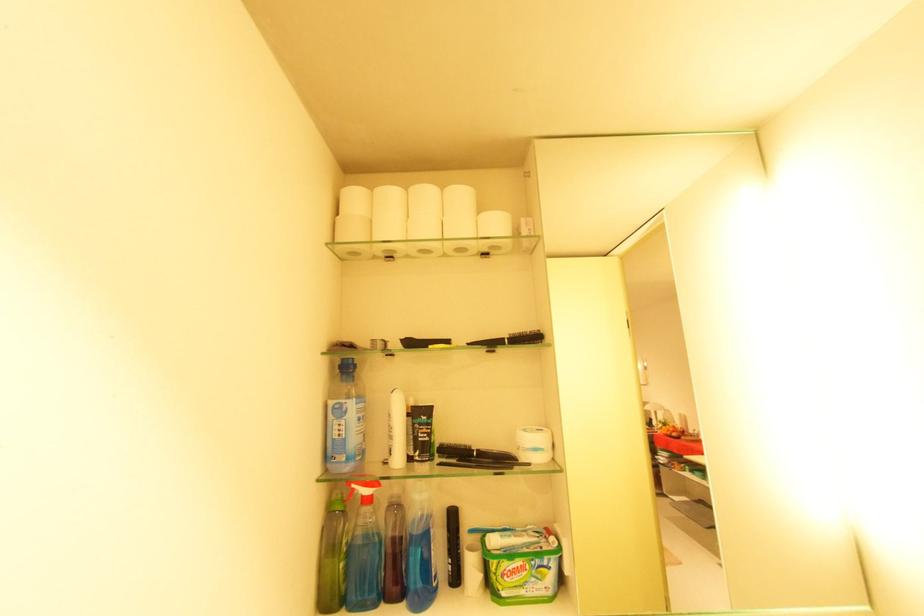
Locate an element on the screen. The height and width of the screenshot is (616, 924). blue cleaning bottle is located at coordinates (345, 419).